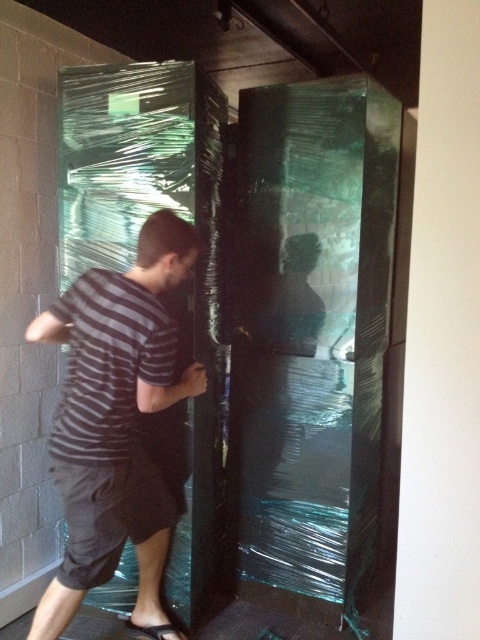
Question: Estimate the real-world distances between objects in this image. Which object is farther from the striped cotton shirt at left?

Choices:
 (A) transparent plastic door at center
 (B) dark gray cotton shorts at lower left

Answer: (A)

Question: Which is farther from the transparent plastic door at center?

Choices:
 (A) dark gray cotton shorts at lower left
 (B) black rubber sandal at lower center

Answer: (B)

Question: Can you confirm if striped cotton shirt at left is thinner than striped cotton shirt at center?

Choices:
 (A) yes
 (B) no

Answer: (B)

Question: Does transparent plastic door at center come in front of striped cotton shirt at center?

Choices:
 (A) no
 (B) yes

Answer: (A)

Question: Among these points, which one is nearest to the camera?

Choices:
 (A) (180, 225)
 (B) (123, 544)
 (C) (144, 632)

Answer: (B)

Question: Does striped cotton shirt at left have a larger size compared to black rubber sandal at lower center?

Choices:
 (A) yes
 (B) no

Answer: (A)